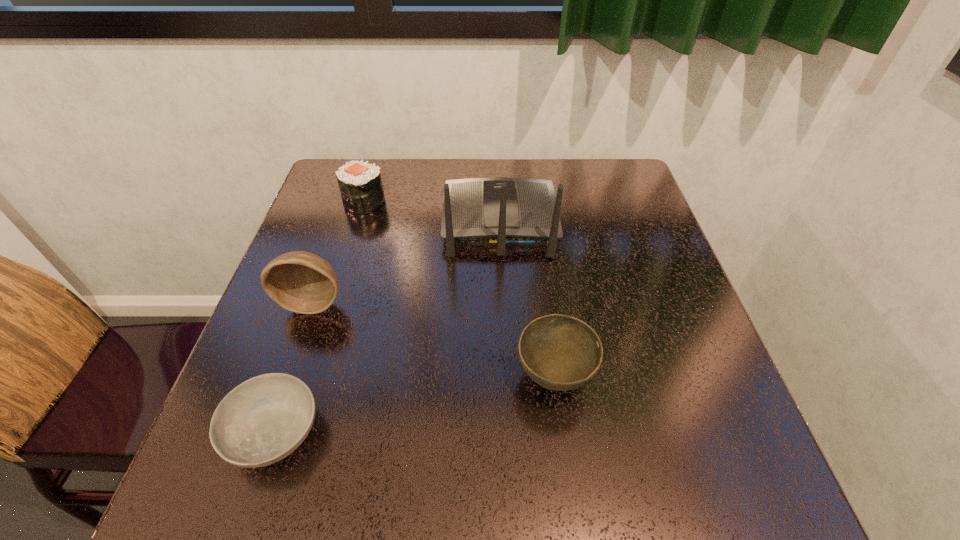
Locate an element on the screen. vacant space at the right edge of the desktop is located at coordinates (665, 410).

I want to click on vacant region at the far right corner of the desktop, so click(618, 202).

Image resolution: width=960 pixels, height=540 pixels. In order to click on vacant space that is in between the router and the tallest bowl in this screenshot , I will do `click(407, 262)`.

Locate an element on the screen. This screenshot has height=540, width=960. free spot between the sushi and the tallest bowl is located at coordinates (339, 252).

Identify the location of free space between the sushi and the router. The image size is (960, 540). (432, 212).

Where is `unoccupied position between the tallest bowl and the shortest object`? This screenshot has height=540, width=960. unoccupied position between the tallest bowl and the shortest object is located at coordinates (295, 367).

Locate an element on the screen. The width and height of the screenshot is (960, 540). free point between the shortest bowl and the sushi is located at coordinates (320, 317).

Where is `vacant space that is in between the router and the third nearest object`? The height and width of the screenshot is (540, 960). vacant space that is in between the router and the third nearest object is located at coordinates (407, 262).

This screenshot has height=540, width=960. Find the location of `vacant region between the tallest object and the rightmost bowl`. vacant region between the tallest object and the rightmost bowl is located at coordinates (527, 300).

Where is `vacant space that is in between the shortest object and the router`? The height and width of the screenshot is (540, 960). vacant space that is in between the shortest object and the router is located at coordinates (388, 327).